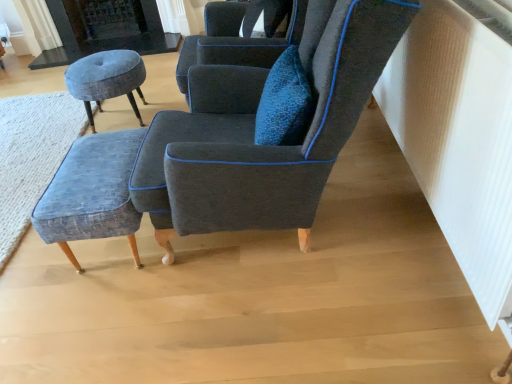
I want to click on space that is in front of textured blue fabric stool at lower left, the first stool in the front-to-back sequence, so click(109, 319).